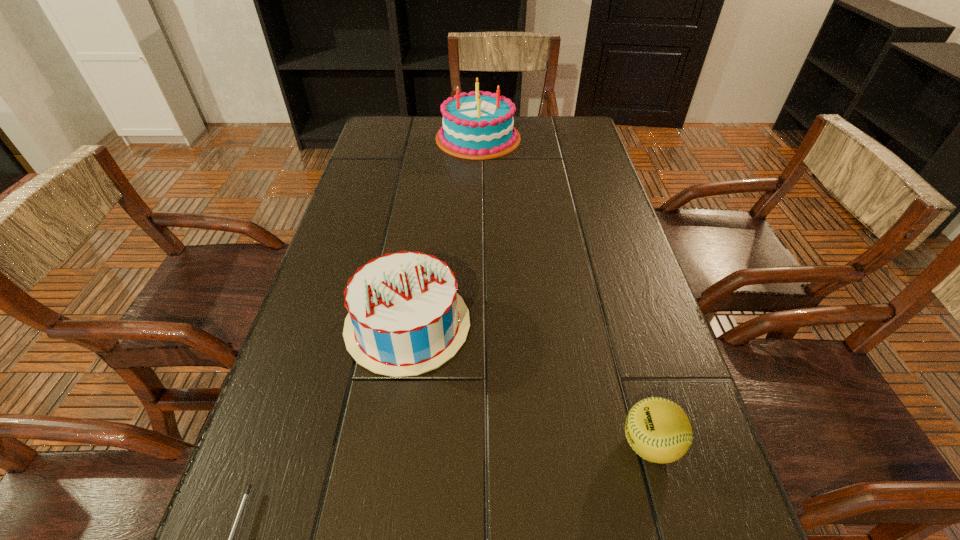
Identify the location of the tallest object. The height and width of the screenshot is (540, 960). (479, 125).

Find the location of `the farther birthday cake`. the farther birthday cake is located at coordinates pos(479,125).

Identify the location of the second tallest object. (405, 318).

Where is `the third nearest object`? the third nearest object is located at coordinates click(405, 318).

You are a GUI agent. You are given a task and a screenshot of the screen. Output one action in this format:
    pyautogui.click(x=<x>, y=<y>)
    Task: Click on the rightmost object
    This screenshot has height=540, width=960.
    Given the screenshot: What is the action you would take?
    pyautogui.click(x=657, y=429)

This screenshot has height=540, width=960. What are the coordinates of `the third tallest object` in the screenshot? It's located at (657, 429).

The image size is (960, 540). I want to click on free spot located 0.240m on the right of the farthest object, so click(x=592, y=138).

Locate an element on the screen. blank space located on the back of the nearer birthday cake is located at coordinates (425, 205).

Locate an element on the screen. The width and height of the screenshot is (960, 540). vacant area located on the logo side of the rightmost object is located at coordinates coord(409,444).

At what (x,y) coordinates should I click in order to perform the action: click on vacant point located on the logo side of the rightmost object. Please return your answer as a coordinate pair (x, y). Looking at the image, I should click on (541, 444).